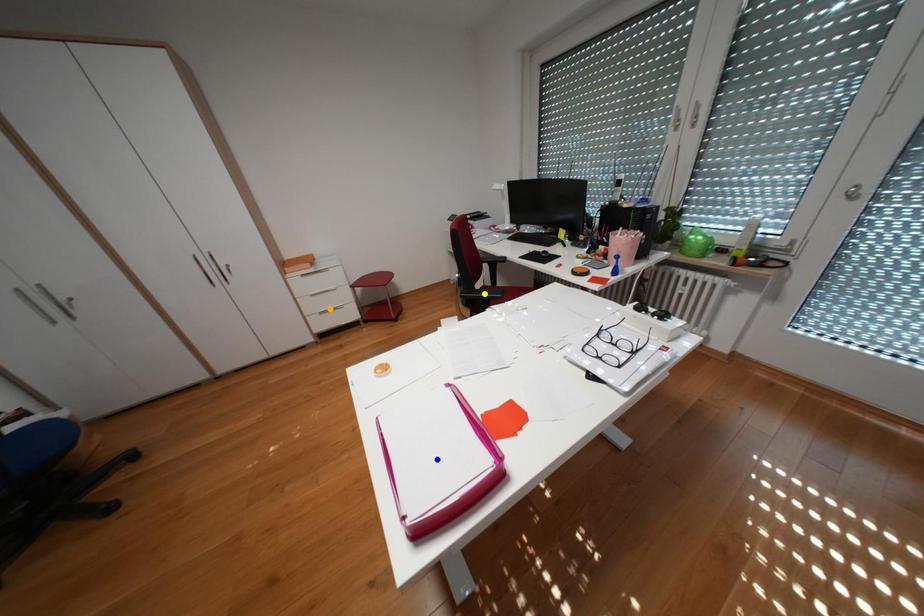
Order these from nearest to farthest:
A) orange point
B) yellow point
C) blue point

orange point, yellow point, blue point